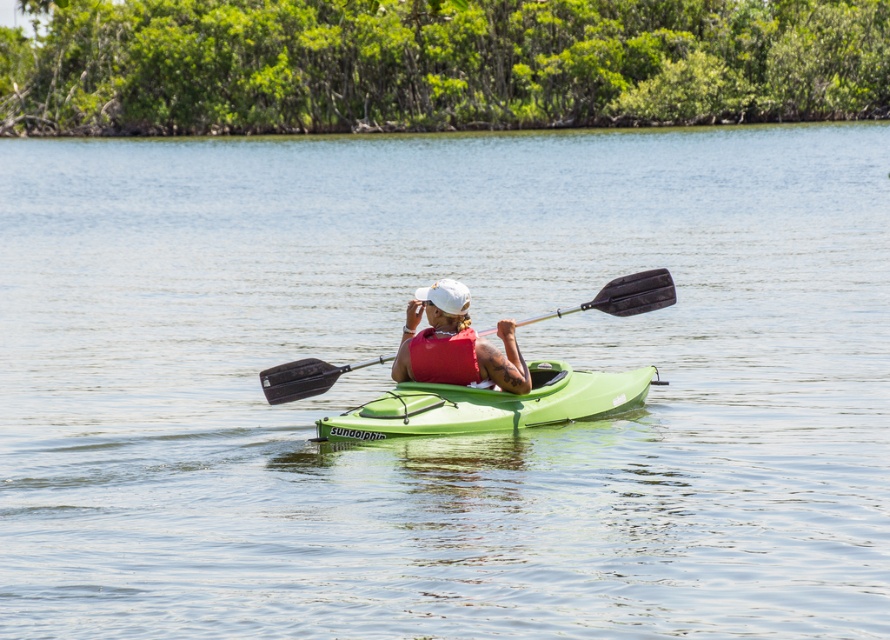
Does green matte kayak at center have a lesser height compared to black rubber paddle at center?

No.

The width and height of the screenshot is (890, 640). Describe the element at coordinates (490, 404) in the screenshot. I see `green matte kayak at center` at that location.

Who is more distant from viewer, (577, 384) or (289, 362)?

The point (289, 362) is more distant.

The width and height of the screenshot is (890, 640). I want to click on green matte kayak at center, so click(x=490, y=404).

Is green matte kayak at center shorter than white matte life vest at center?

Correct, green matte kayak at center is not as tall as white matte life vest at center.

Does point (481, 397) lie behind point (450, 352)?

No, it is not.

The height and width of the screenshot is (640, 890). In order to click on green matte kayak at center in this screenshot , I will do `click(490, 404)`.

Image resolution: width=890 pixels, height=640 pixels. Identify the location of green matte kayak at center. (490, 404).

Can you confirm if white matte life vest at center is bigger than black rubber paddle at center?

Indeed, white matte life vest at center has a larger size compared to black rubber paddle at center.

In the scene shown: Can you confirm if white matte life vest at center is thinner than black rubber paddle at center?

Yes.

Between point (455, 314) and point (672, 300), which one is positioned behind?

The point (672, 300) is behind.

The width and height of the screenshot is (890, 640). What are the coordinates of `white matte life vest at center` in the screenshot? It's located at (455, 342).